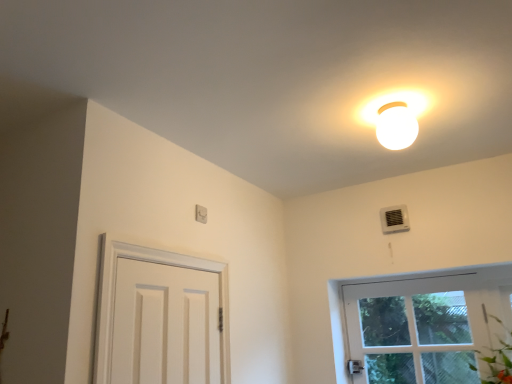
Question: Can you confirm if white plastic light switch at upper center is wider than white glossy light fixture at upper center?

Choices:
 (A) yes
 (B) no

Answer: (B)

Question: Could you tell me if white plastic light switch at upper center is turned towards white glossy light fixture at upper center?

Choices:
 (A) yes
 (B) no

Answer: (A)

Question: Can you see white plastic light switch at upper center touching white glossy light fixture at upper center?

Choices:
 (A) yes
 (B) no

Answer: (B)

Question: Can you confirm if white plastic light switch at upper center is taller than white glossy light fixture at upper center?

Choices:
 (A) no
 (B) yes

Answer: (A)

Question: Can you confirm if white plastic light switch at upper center is positioned to the right of white glossy light fixture at upper center?

Choices:
 (A) yes
 (B) no

Answer: (B)

Question: Is white glossy light fixture at upper center taller or shorter than white plastic light switch at upper center?

Choices:
 (A) tall
 (B) short

Answer: (A)

Question: Is point (414, 115) positioned closer to the camera than point (205, 218)?

Choices:
 (A) closer
 (B) farther

Answer: (A)

Question: In the image, is white glossy light fixture at upper center positioned in front of or behind white plastic light switch at upper center?

Choices:
 (A) behind
 (B) front

Answer: (B)

Question: In terms of size, does white glossy light fixture at upper center appear bigger or smaller than white plastic light switch at upper center?

Choices:
 (A) small
 (B) big

Answer: (B)

Question: Is white plastic light switch at upper center inside or outside of white plastic air conditioner at upper right?

Choices:
 (A) outside
 (B) inside

Answer: (A)

Question: From a real-world perspective, is white plastic light switch at upper center positioned above or below white plastic air conditioner at upper right?

Choices:
 (A) above
 (B) below

Answer: (B)

Question: Considering the positions of white plastic light switch at upper center and white plastic air conditioner at upper right in the image, is white plastic light switch at upper center bigger or smaller than white plastic air conditioner at upper right?

Choices:
 (A) big
 (B) small

Answer: (B)

Question: From the image's perspective, is white plastic light switch at upper center located above or below white plastic air conditioner at upper right?

Choices:
 (A) below
 (B) above

Answer: (B)

Question: Relative to white plastic light switch at upper center, is white plastic air conditioner at upper right in front or behind?

Choices:
 (A) front
 (B) behind

Answer: (B)

Question: Is point (399, 218) closer or farther from the camera than point (199, 216)?

Choices:
 (A) farther
 (B) closer

Answer: (A)